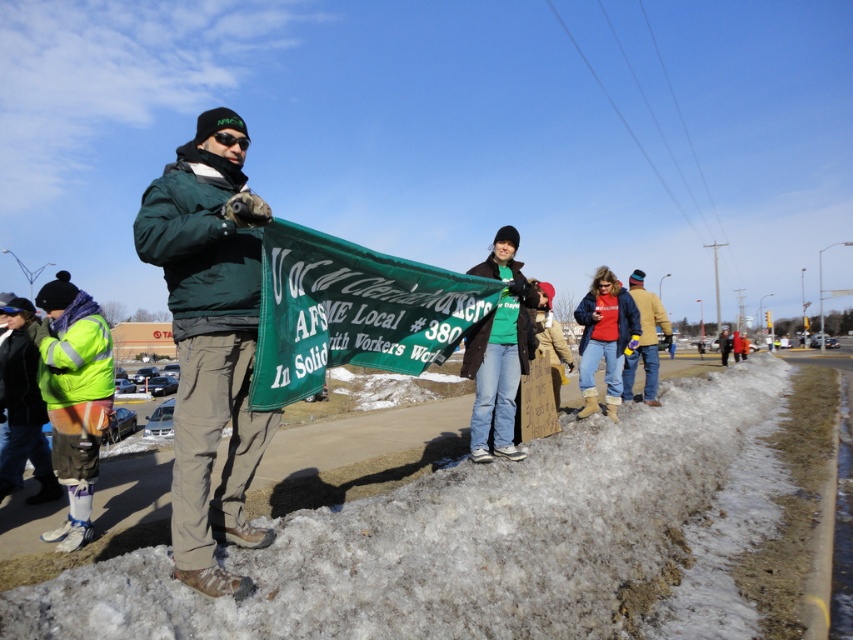
You are a photographer standing in the snow and want to capture a closeup of the green banner held by the man. The banner is 1.5 meters away from you. Considering the white fluffy snow at lower center is 2.09 meters away, will the snow be in focus if you focus on the banner?

The white fluffy snow at lower center is 2.09 meters away from the camera, while the banner is only 1.5 meters away. If you focus on the banner, the snow at 2.09 meters may be slightly out of focus depending on the lens aperture and depth of field. To ensure both are in focus, use a smaller aperture for greater depth of field.

You are a photographer trying to capture a wide shot of the protest scene. You notice the green matte shirt at center and the reflective yellow safety vest at lower left. Which object should you focus on first to ensure both are in frame without cropping either?

The green matte shirt at center is wider than the reflective yellow safety vest at lower left. Therefore, focusing on the green matte shirt at center first will ensure there is enough space in the frame to include both objects without cropping either.